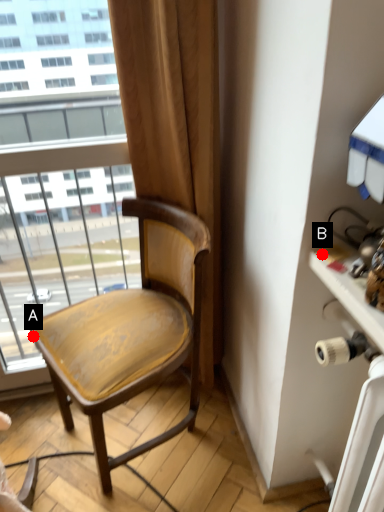
Question: Two points are circled on the image, labeled by A and B beside each circle. Which point is closer to the camera?

Choices:
 (A) A is closer
 (B) B is closer

Answer: (B)